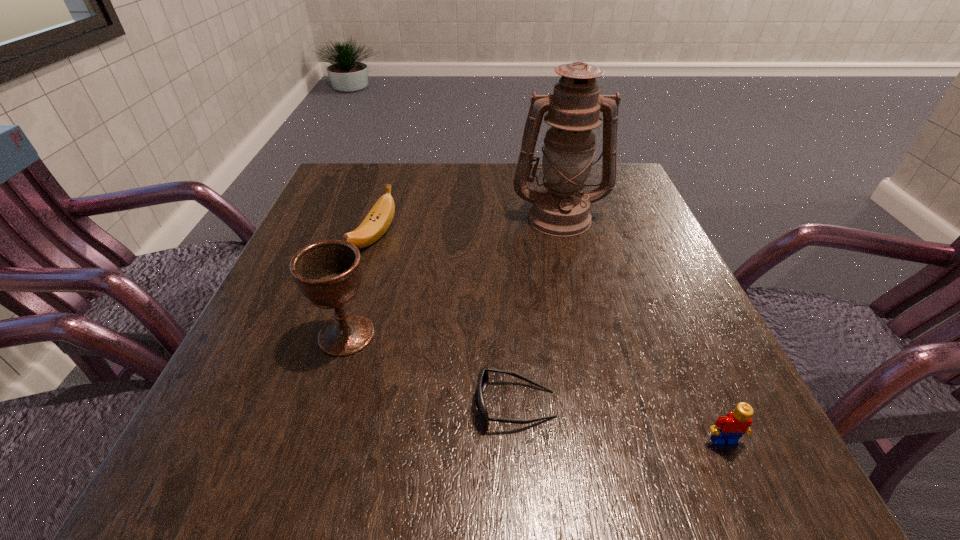
In order to click on Lego present at the right edge in this screenshot , I will do `click(728, 429)`.

This screenshot has height=540, width=960. Find the location of `object positioned at the far right corner`. object positioned at the far right corner is located at coordinates (560, 209).

Identify the location of object present at the near right corner. This screenshot has width=960, height=540. (728, 429).

You are a GUI agent. You are given a task and a screenshot of the screen. Output one action in this format:
    pyautogui.click(x=<x>, y=<y>)
    Task: Click on the vacant area at the far edge
    This screenshot has height=540, width=960.
    Given the screenshot: What is the action you would take?
    pyautogui.click(x=455, y=201)

I want to click on free space at the near edge of the desktop, so click(x=527, y=460).

Image resolution: width=960 pixels, height=540 pixels. Find the location of `vacant region at the left edge of the desktop`. vacant region at the left edge of the desktop is located at coordinates (220, 396).

I want to click on blank space at the right edge, so click(637, 397).

Find the location of a particular element. free space at the far left corner is located at coordinates (322, 211).

In order to click on vacant space at the near left corner in this screenshot , I will do `click(228, 447)`.

The height and width of the screenshot is (540, 960). In order to click on vacant space at the near right corner of the desktop in this screenshot , I will do `click(661, 485)`.